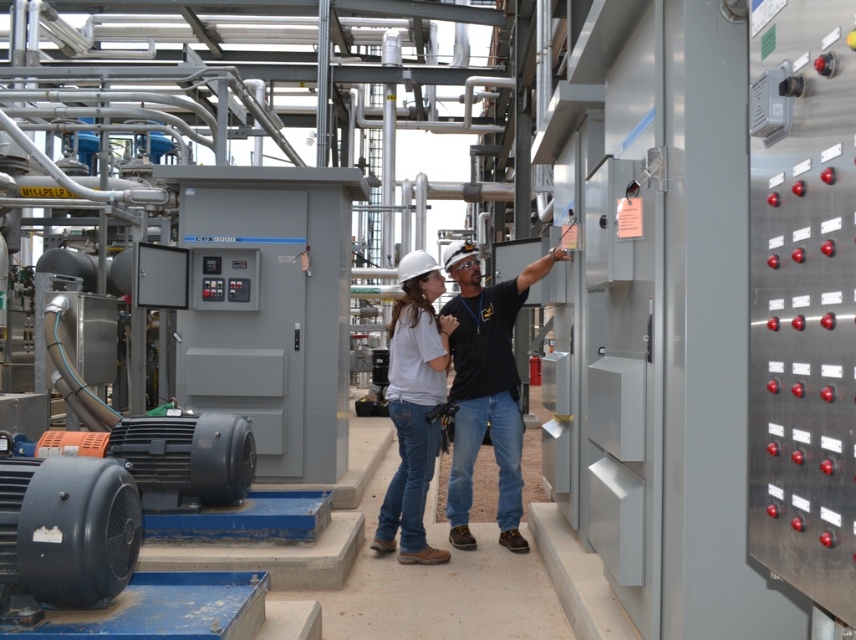
Question: Is matte black shirt at center behind white matte helmet at center?

Choices:
 (A) no
 (B) yes

Answer: (B)

Question: Among these objects, which one is nearest to the camera?

Choices:
 (A) matte black shirt at center
 (B) white matte helmet at center

Answer: (B)

Question: Does matte black shirt at center have a lesser width compared to white matte helmet at center?

Choices:
 (A) yes
 (B) no

Answer: (B)

Question: Among these objects, which one is nearest to the camera?

Choices:
 (A) matte black shirt at center
 (B) white matte helmet at center

Answer: (B)

Question: Does matte black shirt at center come behind white matte helmet at center?

Choices:
 (A) yes
 (B) no

Answer: (A)